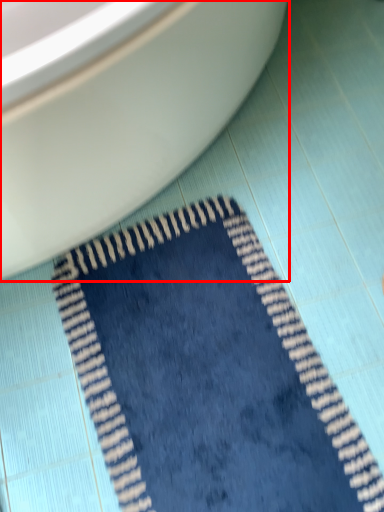
Question: From the image, what is the correct spatial relationship of toilet (annotated by the red box) in relation to doormat?

Choices:
 (A) right
 (B) left

Answer: (B)